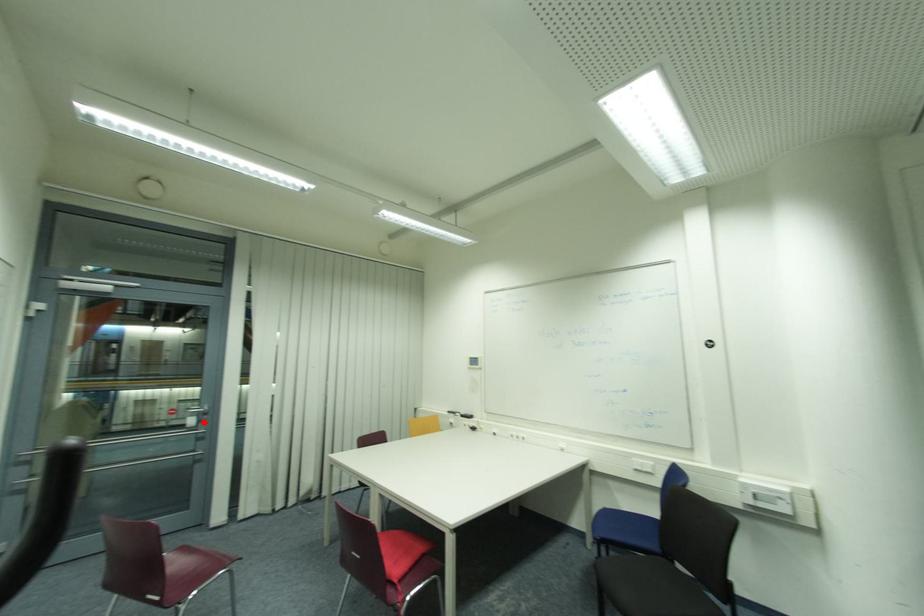
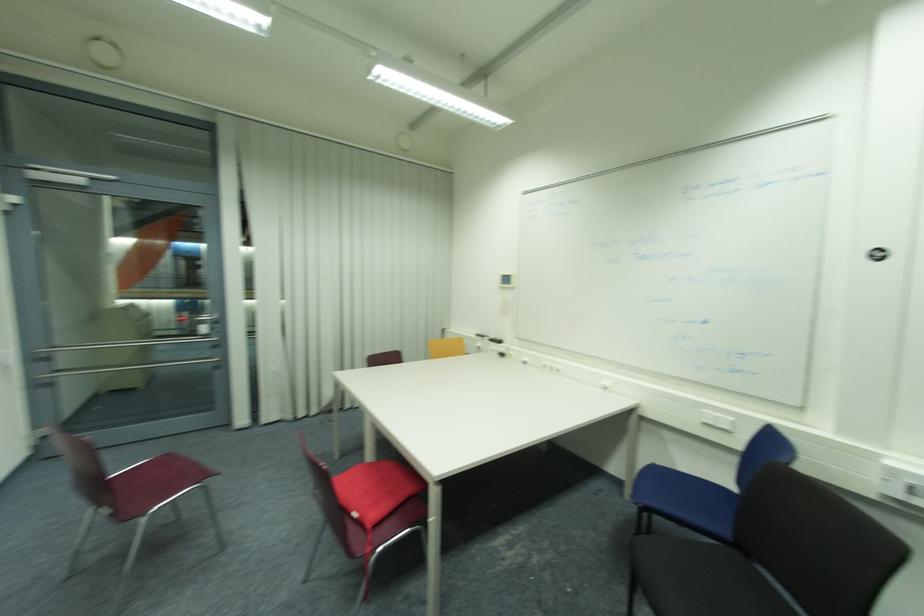
The point at the highlighted location is marked in the first image. Where is the corresponding point in the second image?

(217, 330)